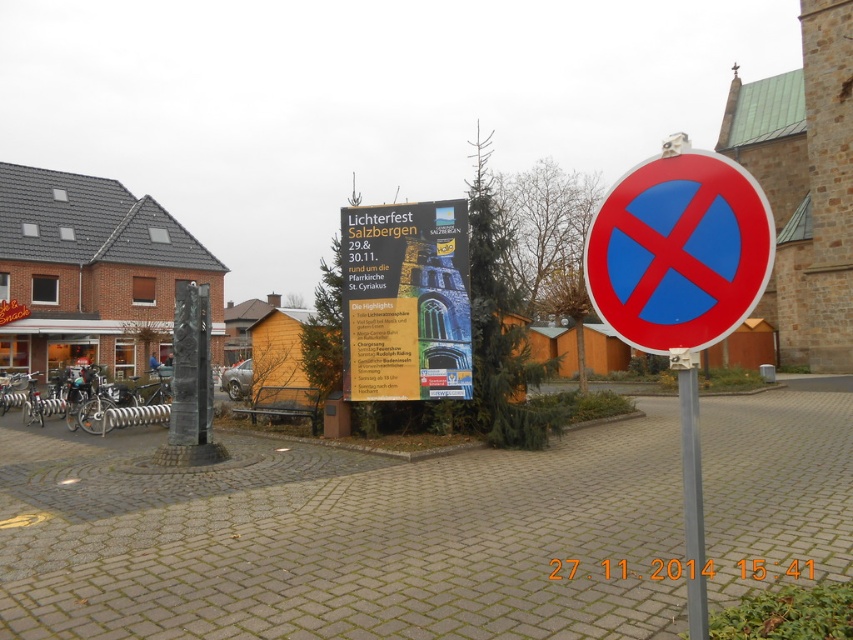
You are a delivery person who needs to hang a new poster that is 1.5 meters tall. You see the white paper poster at center and the silver metallic pole at center. Which object is taller than your new poster?

The white paper poster at center is much taller than the silver metallic pole at center, so the white paper poster at center is taller than your new poster which is 1.5 meters tall.

You are a delivery person who needs to park your van near the red plastic circle at right and the silver metallic pole at center. According to the sign, which object should you avoid parking near because it has a no parking zone?

The red plastic circle at right has a no parking zone indicated by its red circle with a blue center and red diagonal cross, so you should avoid parking near it.

You are a delivery person who needs to place a rectangular box that is 1.2 meters wide between the red plastic circle at right and the silver metallic pole at center. Can the space between them accommodate the box?

The red plastic circle at right is narrower than the silver metallic pole at center, but the exact distance between them isn